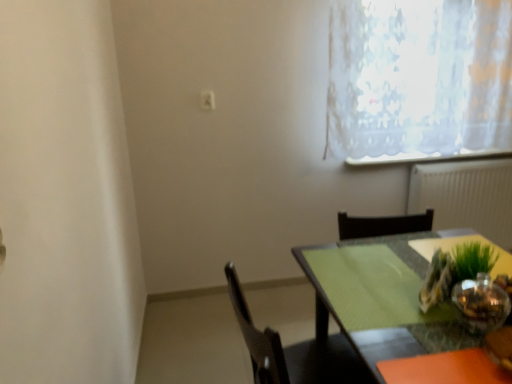
Question: Considering the relative sizes of white textured radiator at right and white lace curtain at upper right in the image provided, is white textured radiator at right wider than white lace curtain at upper right?

Choices:
 (A) yes
 (B) no

Answer: (B)

Question: Is white textured radiator at right positioned with its back to white lace curtain at upper right?

Choices:
 (A) yes
 (B) no

Answer: (B)

Question: Can you confirm if white textured radiator at right is shorter than white lace curtain at upper right?

Choices:
 (A) yes
 (B) no

Answer: (A)

Question: From the image's perspective, would you say white textured radiator at right is shown under white lace curtain at upper right?

Choices:
 (A) no
 (B) yes

Answer: (B)

Question: Could you tell me if white textured radiator at right is facing white lace curtain at upper right?

Choices:
 (A) yes
 (B) no

Answer: (B)

Question: From a real-world perspective, is white textured radiator at right physically located above or below green glass vase at right?

Choices:
 (A) above
 (B) below

Answer: (B)

Question: From the image's perspective, is white textured radiator at right above or below green glass vase at right?

Choices:
 (A) above
 (B) below

Answer: (A)

Question: Is white textured radiator at right in front of or behind green glass vase at right in the image?

Choices:
 (A) behind
 (B) front

Answer: (A)

Question: Considering the positions of white textured radiator at right and green glass vase at right in the image, is white textured radiator at right taller or shorter than green glass vase at right?

Choices:
 (A) tall
 (B) short

Answer: (A)

Question: From the image's perspective, is black matte chair at lower center, which is the 1th chair in bottom-to-top order, located above or below green glass table at center, the first chair in the top-to-bottom sequence?

Choices:
 (A) above
 (B) below

Answer: (B)

Question: In the image, is black matte chair at lower center, which is the 1th chair in bottom-to-top order, positioned in front of or behind green glass table at center, the first chair in the top-to-bottom sequence?

Choices:
 (A) front
 (B) behind

Answer: (A)

Question: Is point (226, 269) positioned closer to the camera than point (374, 221)?

Choices:
 (A) farther
 (B) closer

Answer: (B)

Question: Considering the positions of black matte chair at lower center, which is the 1th chair in bottom-to-top order, and green glass table at center, the second chair in the bottom-to-top sequence, in the image, is black matte chair at lower center, which is the 1th chair in bottom-to-top order, taller or shorter than green glass table at center, the second chair in the bottom-to-top sequence,?

Choices:
 (A) tall
 (B) short

Answer: (A)

Question: Is green glass table at center, the first chair in the top-to-bottom sequence, inside the boundaries of white textured radiator at right, or outside?

Choices:
 (A) inside
 (B) outside

Answer: (B)

Question: From a real-world perspective, is green glass table at center, the first chair in the top-to-bottom sequence, above or below white textured radiator at right?

Choices:
 (A) below
 (B) above

Answer: (B)